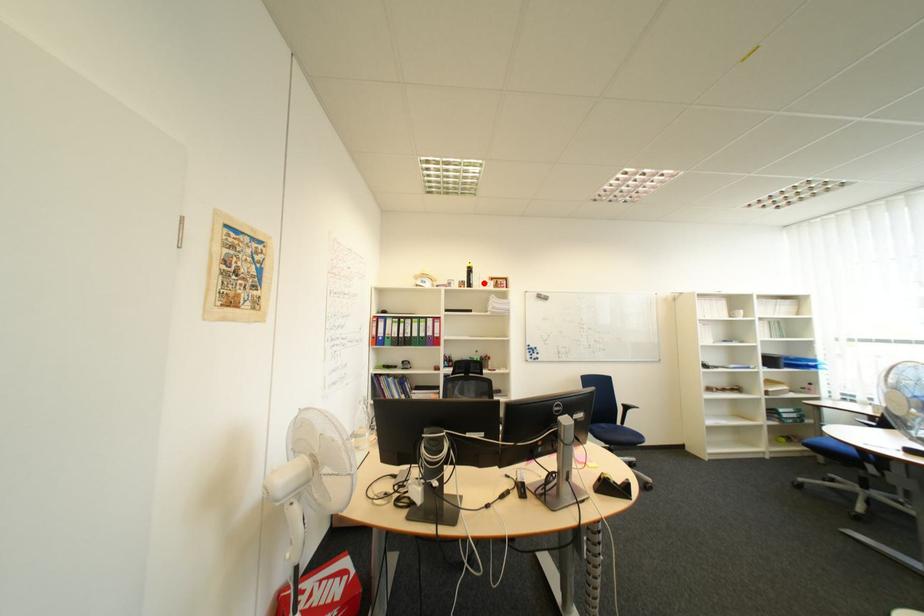
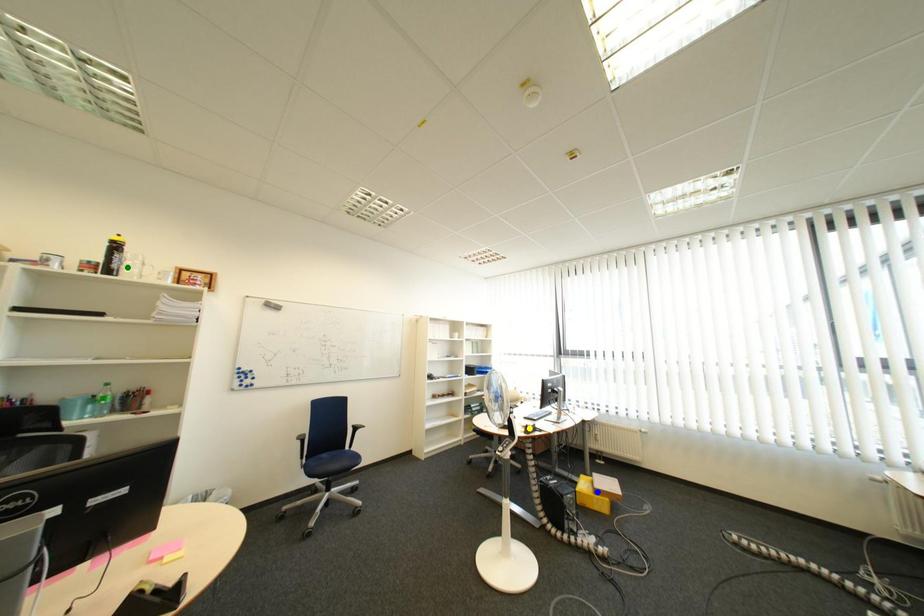
Question: I am providing you with two images of the same scene from different viewpoints. A red point is marked on the first image. You are given multiple points on the second image. Which spot in image 2 lines up with the point in image 1?

Choices:
 (A) yellow point
 (B) green point
 (C) blue point

Answer: (B)